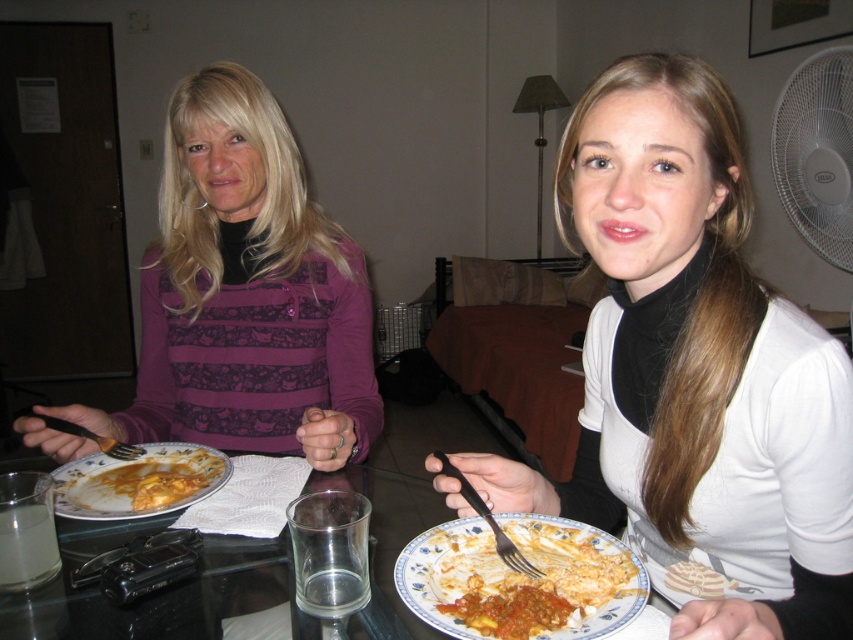
You are a server at a restaurant and need to clear the dishes from the table. Which object should you remove first, the glassy plastic table at center or the porcelain floral plate at lower center?

The porcelain floral plate at lower center should be removed first because it is located above the glassy plastic table at center.

You are standing in front of the glassy plastic table at center and want to place a 12 inch wide book on it. Can the table accommodate the book?

The glassy plastic table at center and viewer are 24.31 inches apart from each other, but the description does not provide the table width. Therefore, it is unknown if the table can accommodate a 12 inch wide book.

You are standing at the origin point of the coordinate system in the dining room. The glassy plastic table at center is located at point 0.925, 0.186. If you want to walk to the table, which direction should you move in terms of the coordinate system?

The glassy plastic table at center is located at point (158, 592), so you should move in the positive x and positive y direction to reach it.